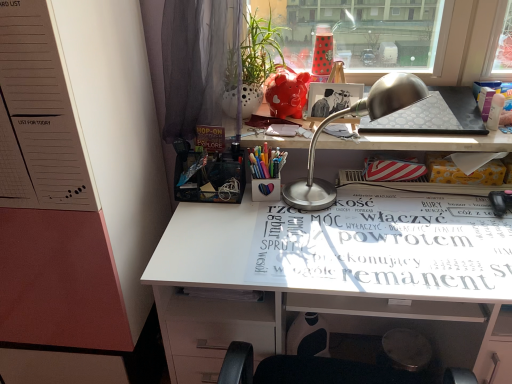
You are a GUI agent. You are given a task and a screenshot of the screen. Output one action in this format:
    pyautogui.click(x=<x>, y=<y>)
    Task: Click on the blank space situated above white paper magazine at center (from a real-world perspective)
    
    Given the screenshot: What is the action you would take?
    pyautogui.click(x=375, y=236)